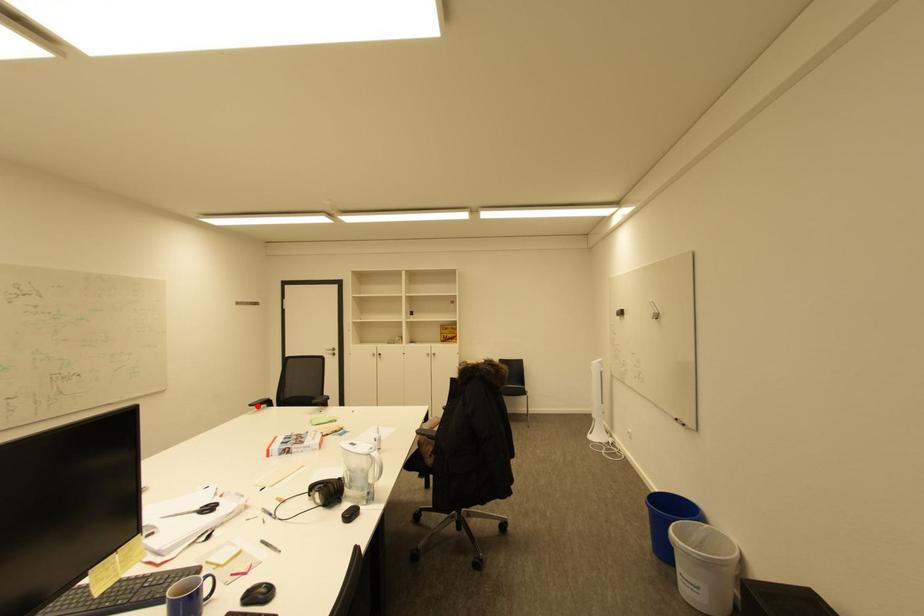
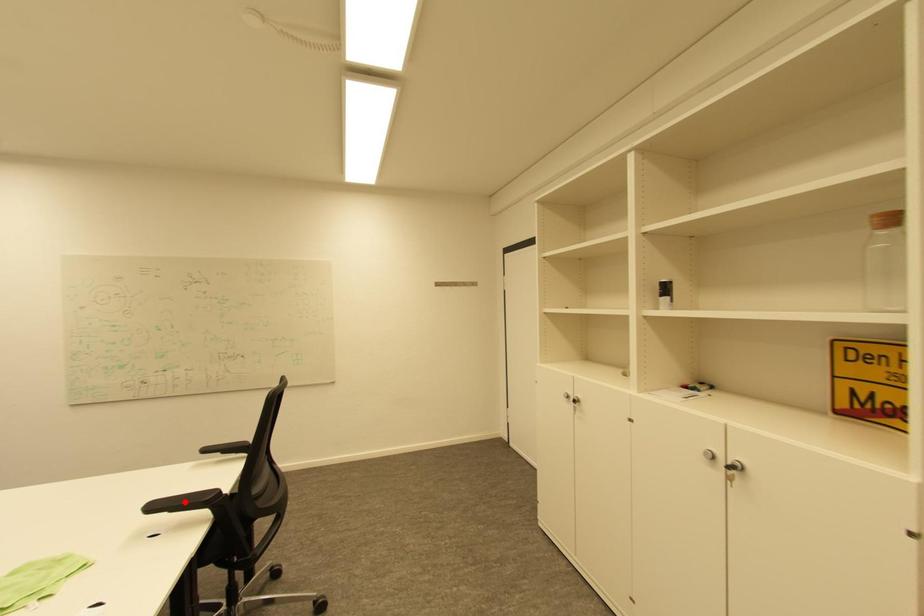
I am providing you with two images of the same scene from different viewpoints. A red point is marked on the first image and another point is marked on the second image. Do the highlighted points in image1 and image2 indicate the same real-world spot?

No